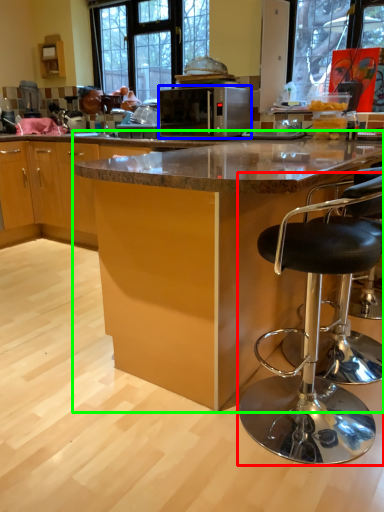
Question: Estimate the real-world distances between objects in this image. Which object is closer to chair (highlighted by a red box), microwave oven (highlighted by a blue box) or table (highlighted by a green box)?

Choices:
 (A) microwave oven
 (B) table

Answer: (B)